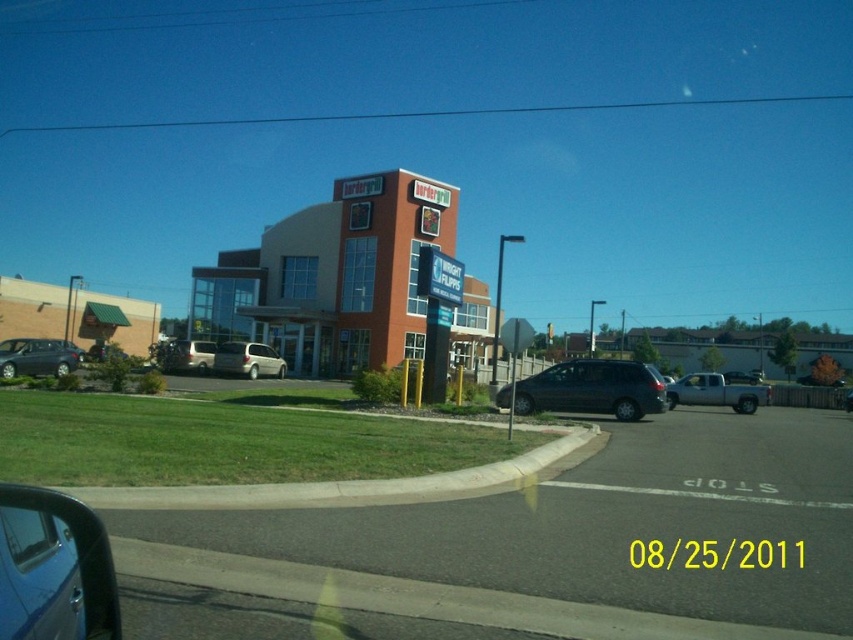
Question: Which point appears farthest from the camera in this image?

Choices:
 (A) (212, 362)
 (B) (558, 378)

Answer: (A)

Question: Does silver metallic minivan at center have a lesser width compared to silver metallic van at center-left?

Choices:
 (A) yes
 (B) no

Answer: (A)

Question: Which object is the closest to the matte gray sedan at left?

Choices:
 (A) metallic blue car at lower left
 (B) silver metallic van at center-left
 (C) satin gray minivan at center
 (D) silver metallic minivan at center

Answer: (B)

Question: Can you confirm if metallic blue car at lower left is smaller than satin gray minivan at center?

Choices:
 (A) yes
 (B) no

Answer: (A)

Question: In this image, where is satin gray minivan at center located relative to silver metallic truck at right?

Choices:
 (A) left
 (B) right

Answer: (A)

Question: Which object appears closest to the camera in this image?

Choices:
 (A) silver metallic truck at right
 (B) satin gray minivan at center
 (C) silver metallic minivan at center

Answer: (B)